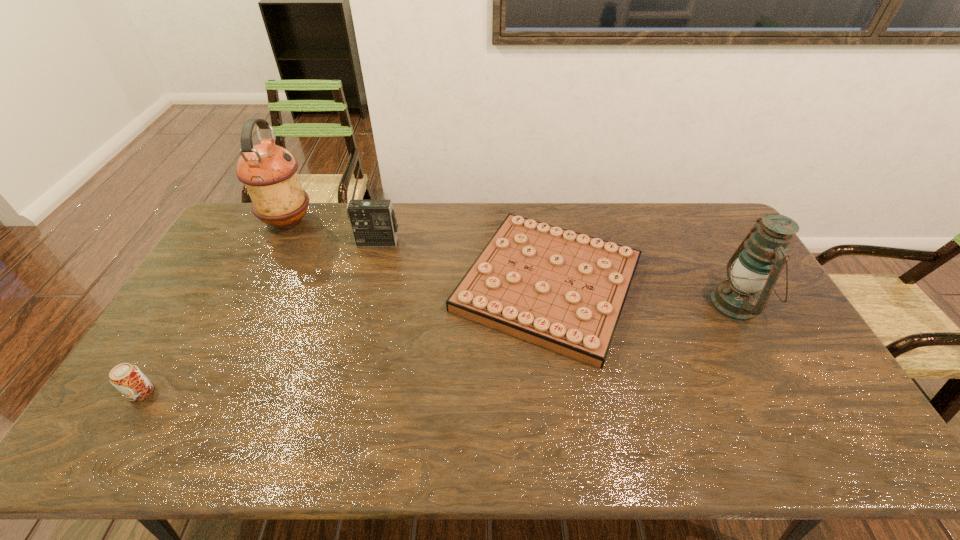
Find the location of a particular element. The height and width of the screenshot is (540, 960). the taller oil lamp is located at coordinates (269, 172).

At what (x,y) coordinates should I click in order to perform the action: click on the left oil lamp. Please return your answer as a coordinate pair (x, y). This screenshot has width=960, height=540. Looking at the image, I should click on (269, 172).

At what (x,y) coordinates should I click in order to perform the action: click on the third object from right to left. Please return your answer as a coordinate pair (x, y). Image resolution: width=960 pixels, height=540 pixels. Looking at the image, I should click on (373, 222).

The height and width of the screenshot is (540, 960). Identify the location of the nearer oil lamp. (757, 263).

Where is `the shorter oil lamp`? The width and height of the screenshot is (960, 540). the shorter oil lamp is located at coordinates (757, 263).

Where is `the nearest object`? the nearest object is located at coordinates (127, 378).

You are a GUI agent. You are given a task and a screenshot of the screen. Output one action in this format:
    pyautogui.click(x=<x>, y=<y>)
    Task: Click on the second shortest object
    The image size is (960, 540).
    Given the screenshot: What is the action you would take?
    pyautogui.click(x=127, y=378)

Image resolution: width=960 pixels, height=540 pixels. What are the coordinates of `the second object from right to left` in the screenshot? It's located at (565, 291).

In order to click on the shortest object in this screenshot , I will do `click(565, 291)`.

The width and height of the screenshot is (960, 540). I want to click on blank space located on the front of the taller oil lamp, so click(x=254, y=287).